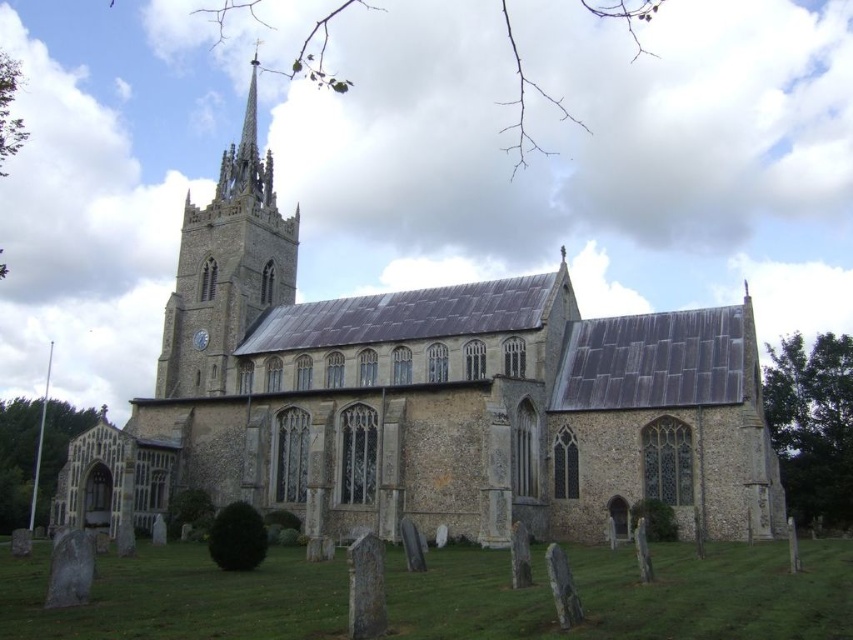
Question: Among these objects, which one is nearest to the camera?

Choices:
 (A) dark gray stone gravestone at lower center
 (B) gray stone gravestone at lower left
 (C) stone church at center

Answer: (A)

Question: Is dark gray stone gravestone at lower center smaller than gray stone gravestone at lower left?

Choices:
 (A) yes
 (B) no

Answer: (A)

Question: Observing the image, what is the correct spatial positioning of stone church at center in reference to gray stone gravestone at lower left?

Choices:
 (A) left
 (B) right

Answer: (B)

Question: Does stone church at center appear on the left side of smooth stone tower at center?

Choices:
 (A) no
 (B) yes

Answer: (A)

Question: Among these points, which one is nearest to the camera?

Choices:
 (A) (456, 512)
 (B) (67, 540)
 (C) (234, 220)

Answer: (B)

Question: Which object is positioned closest to the smooth stone tower at center?

Choices:
 (A) gray stone gravestone at lower left
 (B) dark gray stone gravestone at lower center
 (C) stone church at center

Answer: (C)